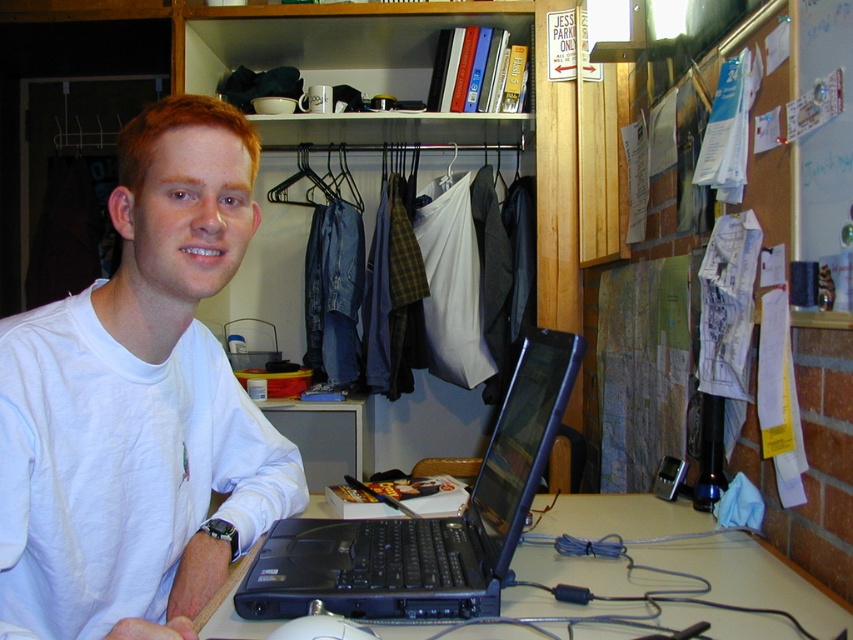
Does white cotton shirt at center have a lesser width compared to black plastic laptop at center?

Correct, white cotton shirt at center's width is less than black plastic laptop at center's.

The height and width of the screenshot is (640, 853). Identify the location of white cotton shirt at center. (138, 404).

The height and width of the screenshot is (640, 853). Find the location of `white cotton shirt at center`. white cotton shirt at center is located at coordinates (138, 404).

Which is behind, point (144, 240) or point (283, 628)?

Point (144, 240)

Can you confirm if white cotton shirt at center is wider than white matte mouse at lower center?

Indeed, white cotton shirt at center has a greater width compared to white matte mouse at lower center.

Who is more distant from viewer, [0,452] or [360,634]?

The point [0,452] is behind.

Locate an element on the screen. white cotton shirt at center is located at coordinates (138, 404).

Describe the element at coordinates (426, 522) in the screenshot. This screenshot has height=640, width=853. I see `black plastic laptop at center` at that location.

Which is in front, point (532, 404) or point (344, 632)?

Positioned in front is point (344, 632).

Which is behind, point (509, 388) or point (273, 637)?

Point (509, 388)

Image resolution: width=853 pixels, height=640 pixels. I want to click on black plastic laptop at center, so click(x=426, y=522).